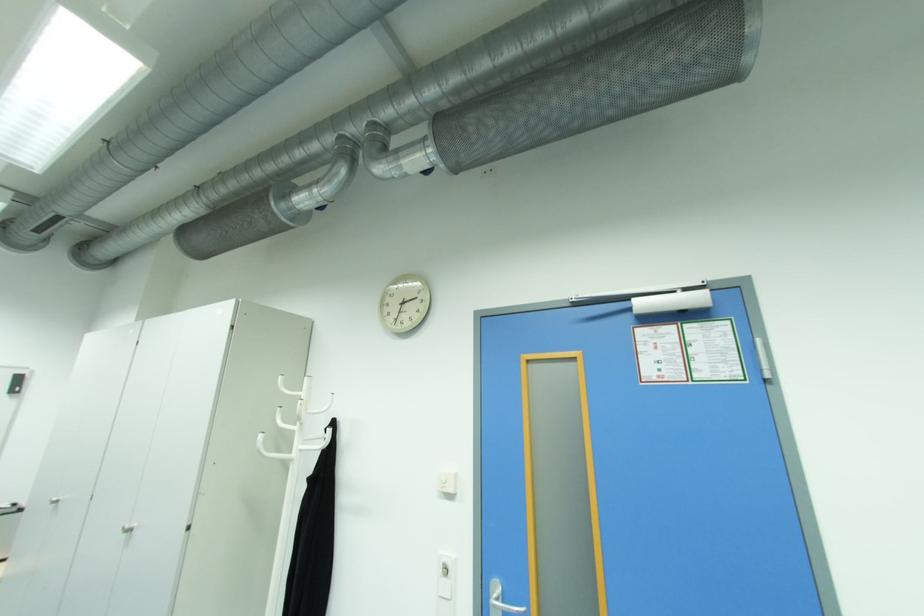
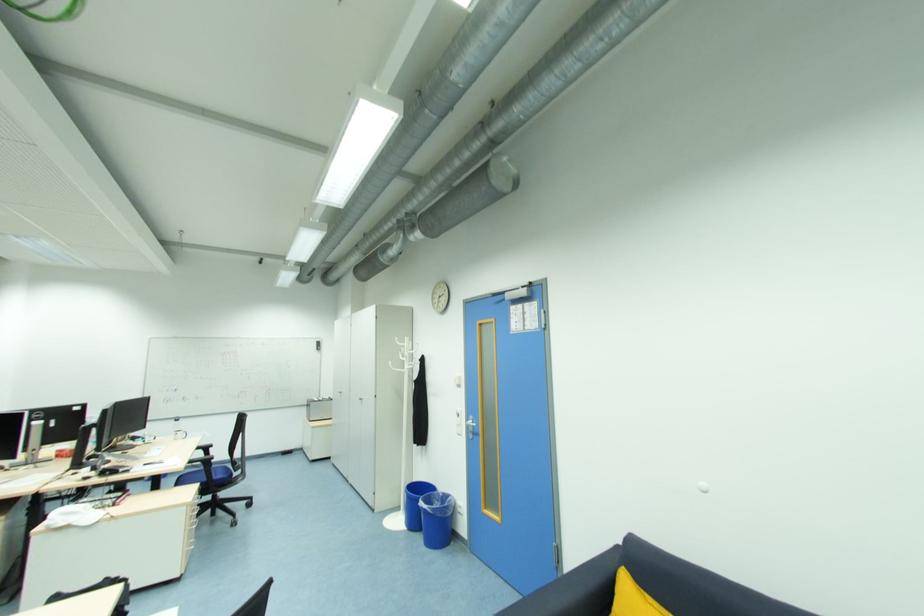
Where in the second image is the point corresponding to (300,448) from the first image?

(409, 368)